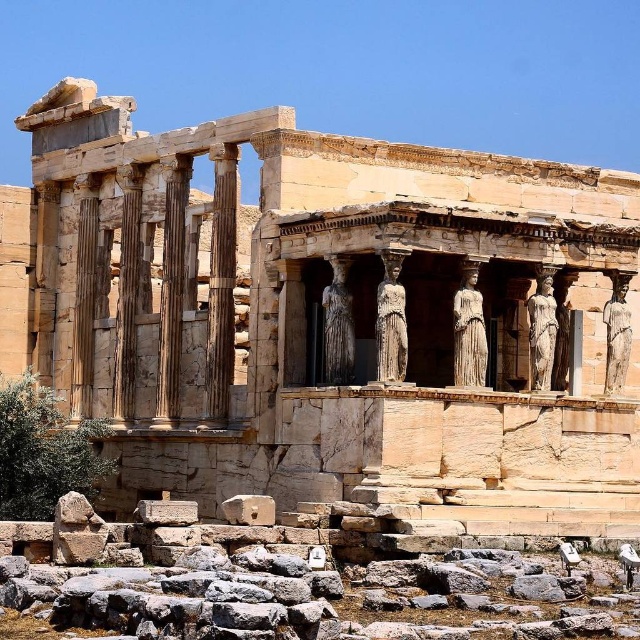
Question: Can you confirm if white marble statue at center is positioned below polished stone statue at center?

Choices:
 (A) no
 (B) yes

Answer: (A)

Question: Which object is the farthest from the polished stone statue at center?

Choices:
 (A) polished marble statue at center
 (B) beige stone temple at center

Answer: (B)

Question: Does beige stone temple at center appear under polished marble statue at center?

Choices:
 (A) no
 (B) yes

Answer: (A)

Question: Does white marble statue at center appear on the right side of polished stone statue at center?

Choices:
 (A) yes
 (B) no

Answer: (B)

Question: Based on their relative distances, which object is nearer to the polished stone statue at center?

Choices:
 (A) polished marble statue at center
 (B) white marble statue at center
 (C) marble statue at center
 (D) smooth gray stone statue at center

Answer: (B)

Question: Which point appears farthest from the camera in this image?

Choices:
 (A) (480, 332)
 (B) (182, 483)
 (C) (554, 300)
 (D) (614, 337)

Answer: (B)